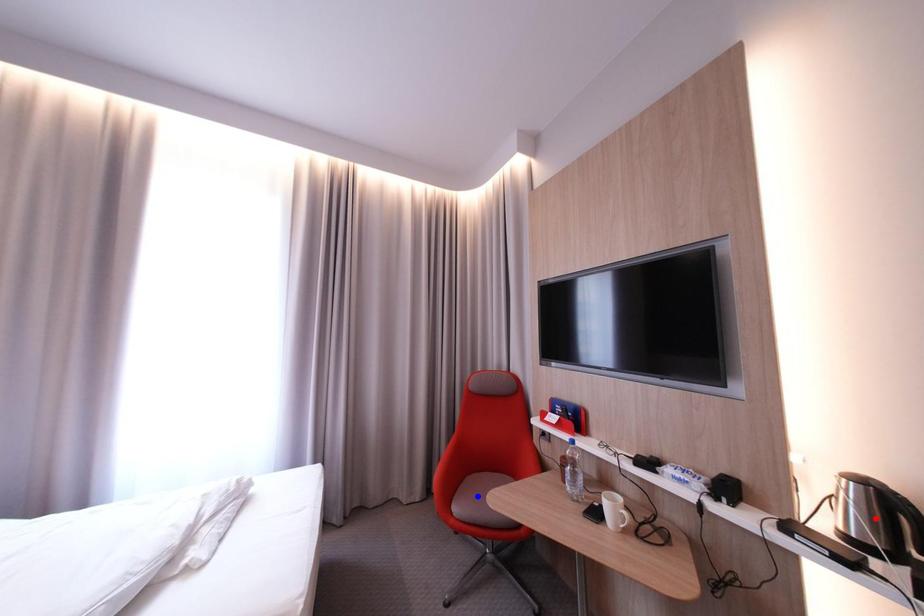
Question: Which of the two points in the image is closer to the camera?

Choices:
 (A) Blue point is closer.
 (B) Red point is closer.

Answer: (B)